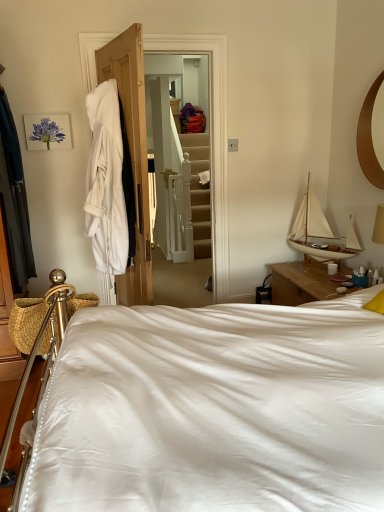
This screenshot has width=384, height=512. In order to click on free area behind white ceramic mug at upper right in this screenshot , I will do `click(321, 269)`.